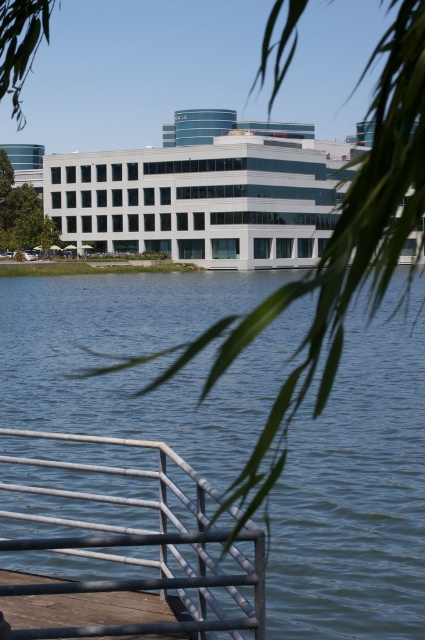
You are standing on the brown wooden dock at lower left and want to move to the silver metallic rail at lower left. Which direction should you walk to reach it?

You should walk to your left because the silver metallic rail at lower left is positioned to the left of the brown wooden dock at lower left.

Consider the image. You are standing on the dock and want to throw a stone into the water. Based on the scene, which object is closer to you when you look down? The blue water at lower center or the brown wooden dock at lower left?

The blue water at lower center is closer to the viewer than the brown wooden dock at lower left, so when you look down, the blue water at lower center is closer to you.

You are standing at the entrance of the modern office building and see the point at coordinates (124, 548). What object is located at this point?

The point at coordinates (124, 548) is on the silver metallic rail at lower left.